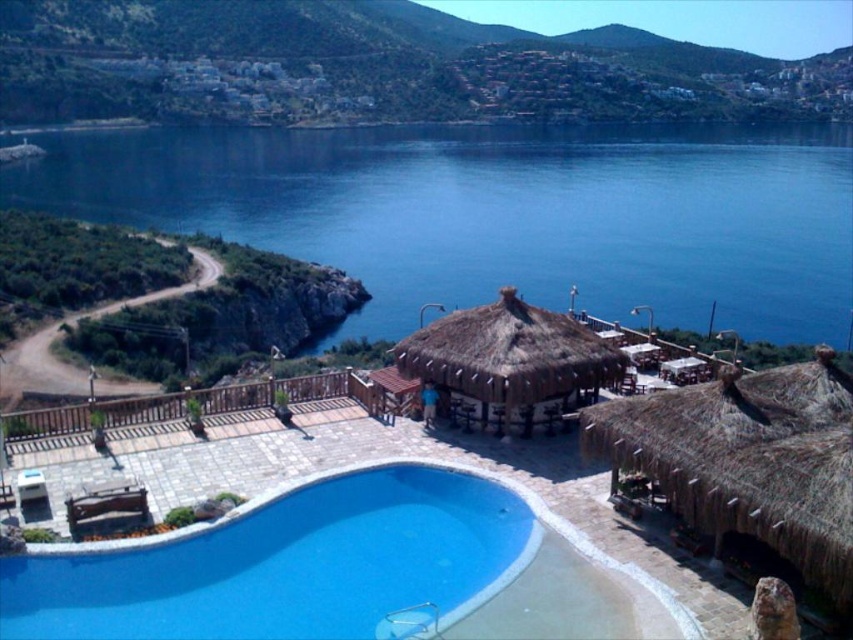
In the scene shown: You are standing at the point marked as point (498, 212) in the coastal scene. What do you see directly in front of you?

At point (498, 212) lies blue water at upper center, so you would see blue water at upper center directly in front of you.